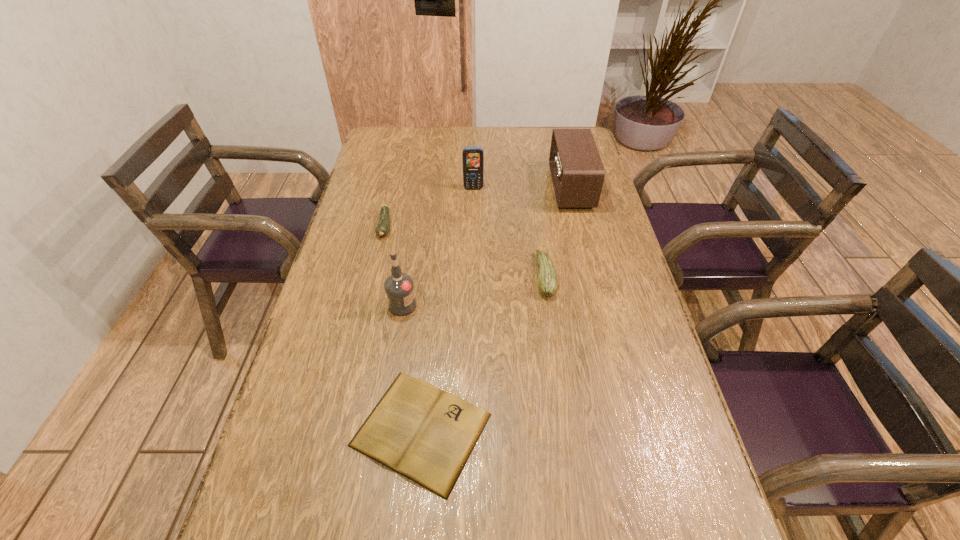
Locate an element on the screen. free region located 0.230m on the screen of the cellular telephone is located at coordinates (472, 233).

Where is `free space located on the front-facing side of the radio receiver`? This screenshot has height=540, width=960. free space located on the front-facing side of the radio receiver is located at coordinates (514, 188).

Identify the location of free space located on the front-facing side of the radio receiver. This screenshot has height=540, width=960. (443, 188).

Find the location of `free point located on the front-facing side of the radio receiver`. free point located on the front-facing side of the radio receiver is located at coordinates (443, 188).

The height and width of the screenshot is (540, 960). In order to click on vacant space located 0.340m at the stem end of the fourth tallest object in this screenshot , I will do coord(417,275).

The height and width of the screenshot is (540, 960). I want to click on vacant point located at the stem end of the fourth tallest object, so [x=406, y=275].

This screenshot has width=960, height=540. What are the coordinates of `vacant space located at the stem end of the fourth tallest object` in the screenshot? It's located at (417, 275).

At what (x,y) coordinates should I click in order to perform the action: click on free space located 0.050m at the blossom end of the leftmost object. Please return your answer as a coordinate pair (x, y). The image size is (960, 540). Looking at the image, I should click on (378, 254).

Image resolution: width=960 pixels, height=540 pixels. What are the coordinates of `vacant point located 0.320m on the back of the shortest object` in the screenshot? It's located at (436, 275).

Identify the location of zucchini that is positioned at the left edge. (382, 229).